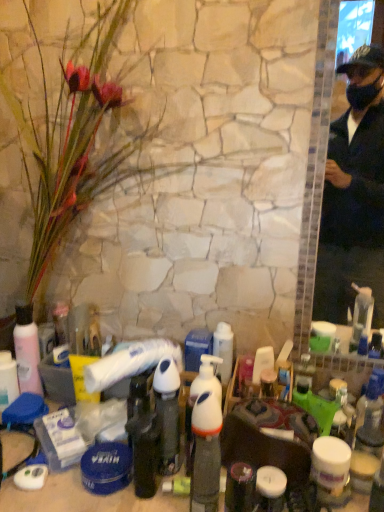
Question: From a real-world perspective, is silky pink petals at left located beneath white glossy pump bottle at center, the 1th bottle when ordered from right to left?

Choices:
 (A) no
 (B) yes

Answer: (A)

Question: Can you confirm if silky pink petals at left is bigger than white glossy pump bottle at center, which is the fourth bottle in back-to-front order?

Choices:
 (A) yes
 (B) no

Answer: (A)

Question: Could white glossy pump bottle at center, the fourth bottle in the left-to-right sequence, be considered to be inside silky pink petals at left?

Choices:
 (A) yes
 (B) no

Answer: (B)

Question: Is silky pink petals at left positioned with its back to white glossy pump bottle at center, the first bottle from the front?

Choices:
 (A) yes
 (B) no

Answer: (B)

Question: Is the position of silky pink petals at left more distant than that of white glossy pump bottle at center, the 1th bottle when ordered from right to left?

Choices:
 (A) yes
 (B) no

Answer: (B)

Question: Considering the relative sizes of silky pink petals at left and white glossy pump bottle at center, the 1th bottle when ordered from right to left, in the image provided, is silky pink petals at left wider than white glossy pump bottle at center, the 1th bottle when ordered from right to left,?

Choices:
 (A) no
 (B) yes

Answer: (B)

Question: From the image's perspective, does white glossy pump bottle at center, the first bottle from the front, appear lower than silky pink petals at left?

Choices:
 (A) no
 (B) yes

Answer: (B)

Question: Are white glossy pump bottle at center, the fourth bottle in the left-to-right sequence, and silky pink petals at left located far from each other?

Choices:
 (A) no
 (B) yes

Answer: (A)

Question: From the image's perspective, is white glossy pump bottle at center, which is the fourth bottle in back-to-front order, located above silky pink petals at left?

Choices:
 (A) yes
 (B) no

Answer: (B)

Question: Considering the relative sizes of white glossy pump bottle at center, the 1th bottle when ordered from right to left, and silky pink petals at left in the image provided, is white glossy pump bottle at center, the 1th bottle when ordered from right to left, bigger than silky pink petals at left?

Choices:
 (A) no
 (B) yes

Answer: (A)

Question: Is white glossy pump bottle at center, the fourth bottle in the left-to-right sequence, wider than silky pink petals at left?

Choices:
 (A) no
 (B) yes

Answer: (A)

Question: Can you confirm if white glossy pump bottle at center, the fourth bottle in the left-to-right sequence, is smaller than silky pink petals at left?

Choices:
 (A) no
 (B) yes

Answer: (B)

Question: Is silky pink petals at left shorter than white pump bottle at center?

Choices:
 (A) yes
 (B) no

Answer: (B)